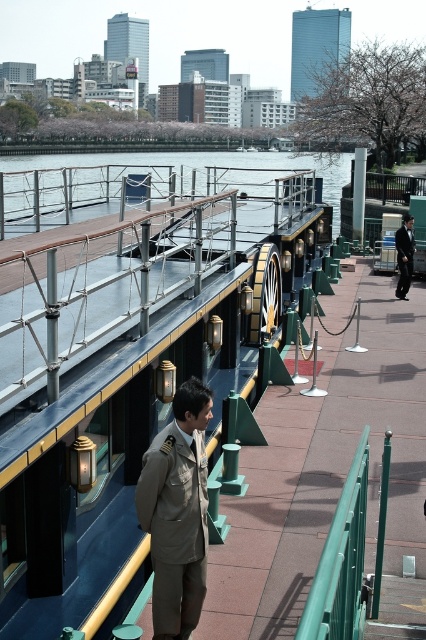
Question: Which object appears closest to the camera in this image?

Choices:
 (A) black suit at center
 (B) blue polished wood boat at center

Answer: (B)

Question: Estimate the real-world distances between objects in this image. Which object is closer to the khaki fabric trench coat at center?

Choices:
 (A) black suit at center
 (B) blue polished wood boat at center

Answer: (B)

Question: Where is blue polished wood boat at center located in relation to khaki fabric trench coat at center in the image?

Choices:
 (A) above
 (B) below

Answer: (A)

Question: Which of these objects is positioned closest to the khaki fabric trench coat at center?

Choices:
 (A) blue polished wood boat at center
 (B) black suit at center

Answer: (A)

Question: Does blue polished wood boat at center lie behind khaki fabric trench coat at center?

Choices:
 (A) yes
 (B) no

Answer: (B)

Question: Does blue polished wood boat at center appear over khaki fabric trench coat at center?

Choices:
 (A) yes
 (B) no

Answer: (A)